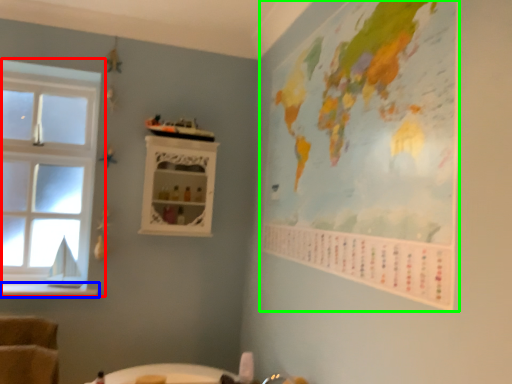
Question: Which object is the closest to the window (highlighted by a red box)? Choose among these: window sill (highlighted by a blue box) or map (highlighted by a green box).

Choices:
 (A) window sill
 (B) map

Answer: (A)